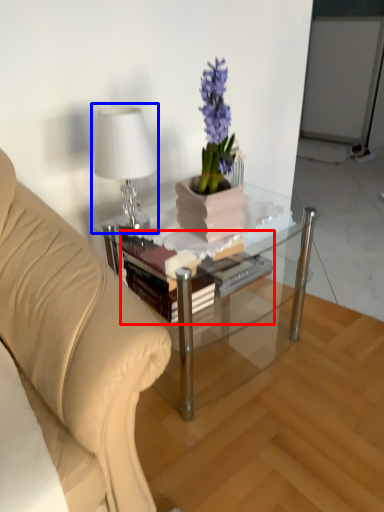
Question: Which of the following is the closest to the observer, book (highlighted by a red box) or table lamp (highlighted by a blue box)?

Choices:
 (A) book
 (B) table lamp

Answer: (B)